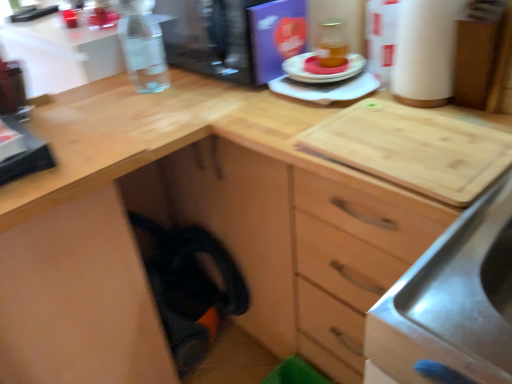
At what (x,y) coordinates should I click in order to perform the action: click on free space above matte plastic plate at center, placed as the second appliance when sorted from top to bottom (from a real-world perspective). Please return your answer as a coordinate pair (x, y). The image size is (512, 384). Looking at the image, I should click on (318, 69).